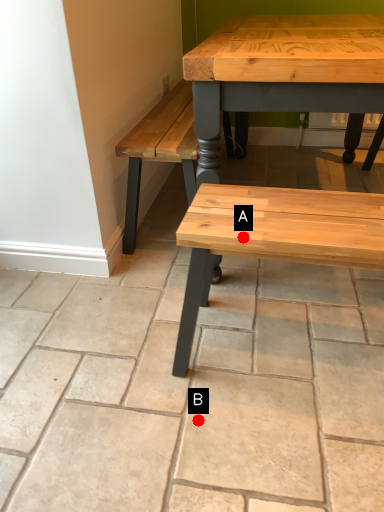
Question: Two points are circled on the image, labeled by A and B beside each circle. Which point is farther to the camera?

Choices:
 (A) A is further
 (B) B is further

Answer: (B)